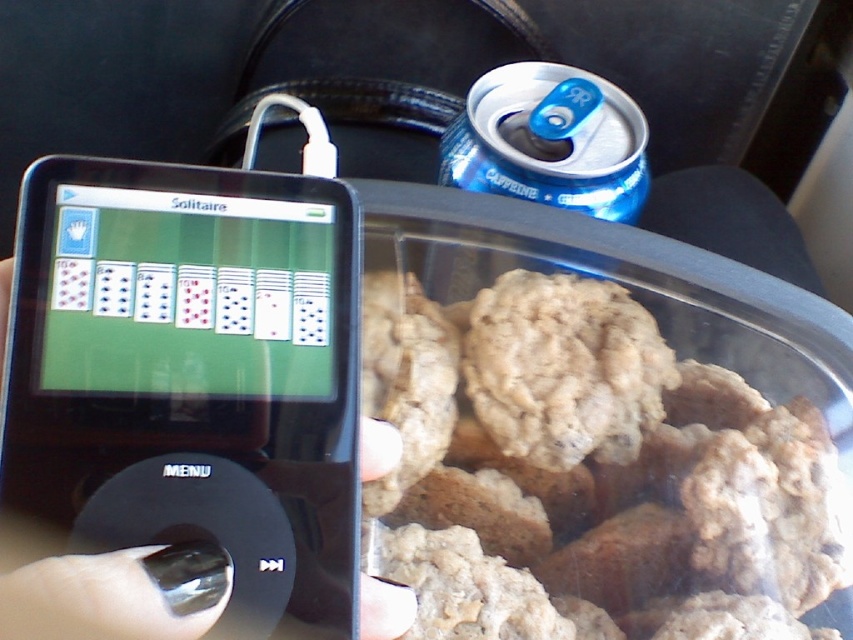
You are a photographer trying to capture the black glossy ipod at left in the image. Based on its position coordinates, where should you aim your camera?

The black glossy ipod at left is located at coordinates point (192, 374), so aim your camera at that position to capture it.

You are a person trying to reach for the blue metallic can at upper right but there are baked oatmeal cookies at lower right in the way. Can you move the cookies to the left to make space?

The baked oatmeal cookies at lower right are already to the left of the blue metallic can at upper right, so moving them further left might not help. Consider moving them to the right instead.

You are a chef who needs to place both the black glossy ipod at left and the blue metallic can at upper right on a shelf. The shelf has limited vertical space. Which object should you place first to ensure both fit vertically?

The blue metallic can at upper right is shorter than the black glossy ipod at left, so place the taller black glossy ipod at left first to accommodate its height, then the shorter blue metallic can at upper right will fit below it.